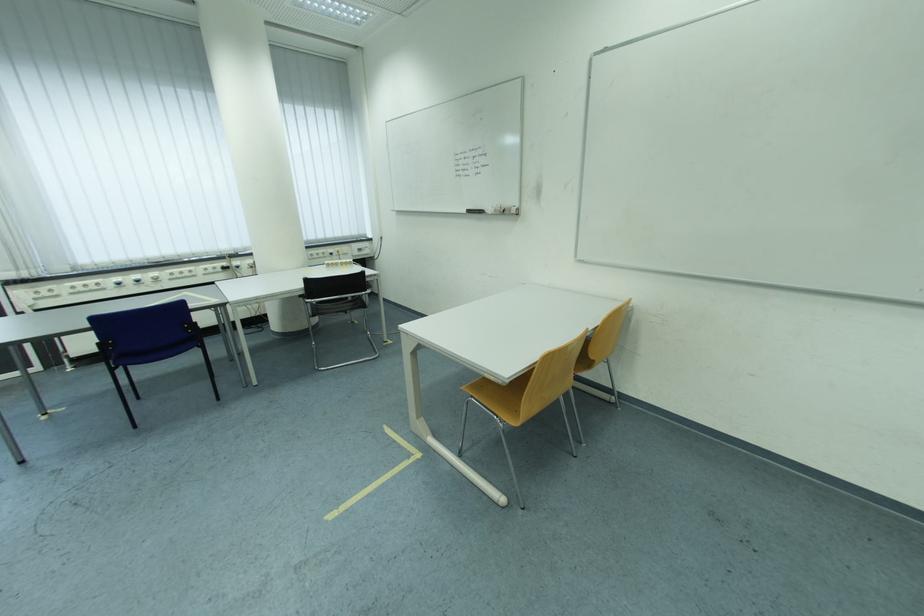
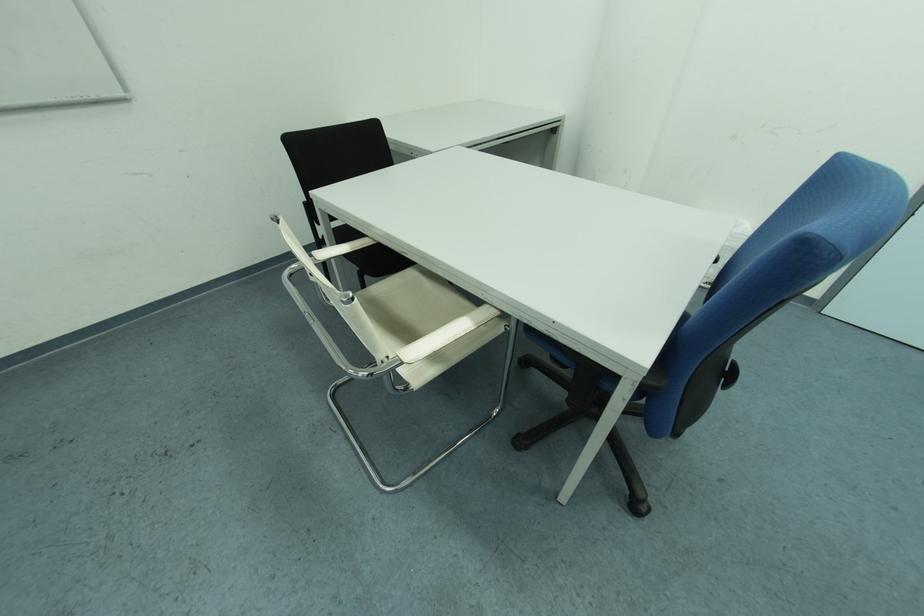
The images are taken continuously from a first-person perspective. In which direction is your viewpoint rotating?

The camera's rotation is toward right-down.